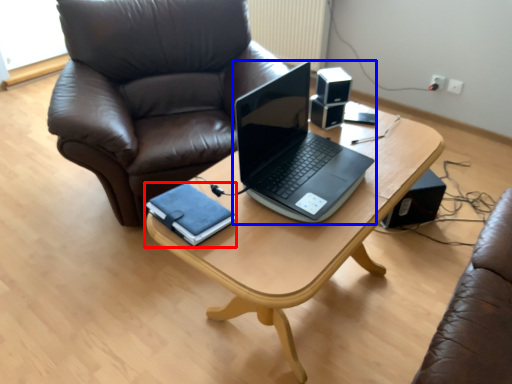
Question: Which point is further to the camera, notebook (highlighted by a red box) or laptop (highlighted by a blue box)?

Choices:
 (A) notebook
 (B) laptop

Answer: (A)